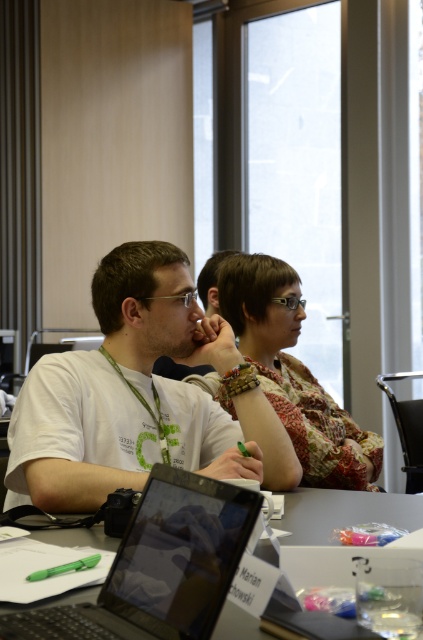
You are a photographer in the conference room and need to capture a clear shot of the matte black laptop at center without the patterned fabric blouse at center blocking it. Can you adjust your position to do so?

The matte black laptop at center is below the patterned fabric blouse at center, so by lowering your camera angle or moving to a lower position, you can capture the laptop without the blouse blocking it.